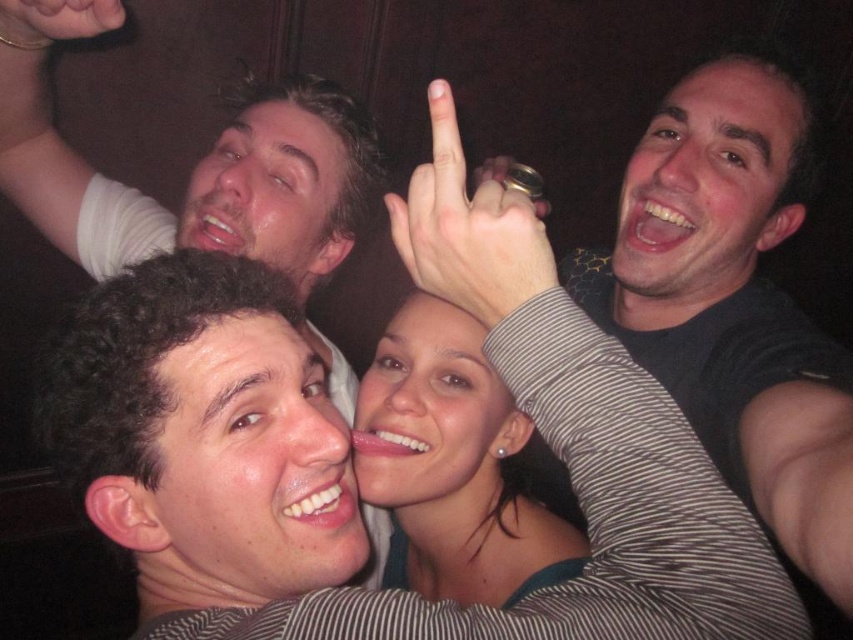
Looking at this image, is black matte shirt at upper right wider than matte black hand at upper left?

Yes.

In the scene shown: Which is more to the left, black matte shirt at upper right or matte black hand at upper left?

matte black hand at upper left is more to the left.

Is point (763, 44) positioned after point (25, 29)?

Yes, point (763, 44) is behind point (25, 29).

Find the location of `black matte shirt at upper right`. black matte shirt at upper right is located at coordinates (740, 298).

Does point (816, 118) come closer to viewer compared to point (461, 150)?

No, it is behind (461, 150).

Describe the element at coordinates (740, 298) in the screenshot. The width and height of the screenshot is (853, 640). I see `black matte shirt at upper right` at that location.

In order to click on black matte shirt at upper right in this screenshot , I will do `click(740, 298)`.

Between black matte shirt at upper right and matte green dress at center, which one appears on the right side from the viewer's perspective?

Positioned to the right is black matte shirt at upper right.

Measure the distance between point (698,141) and camera.

Point (698,141) and camera are 3.45 feet apart from each other.

Is point (677, 189) behind point (486, 438)?

Yes, point (677, 189) is farther from viewer.

Find the location of `black matte shirt at upper right`. black matte shirt at upper right is located at coordinates (740, 298).